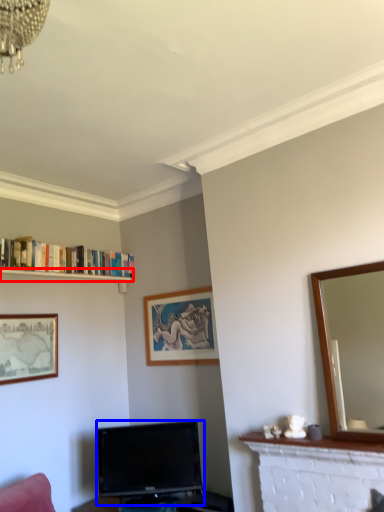
Question: Which object is closer to the camera taking this photo, shelf (highlighted by a red box) or television (highlighted by a blue box)?

Choices:
 (A) shelf
 (B) television

Answer: (B)